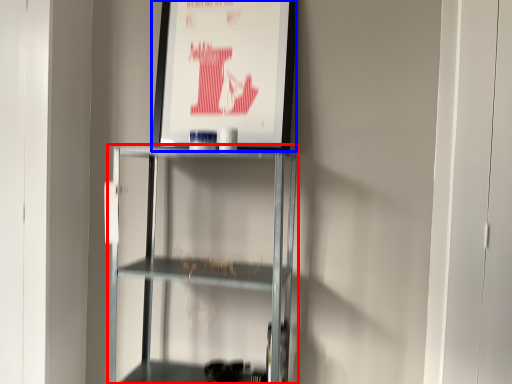
Question: Which object is further to the camera taking this photo, shelf (highlighted by a red box) or poster page (highlighted by a blue box)?

Choices:
 (A) shelf
 (B) poster page

Answer: (B)